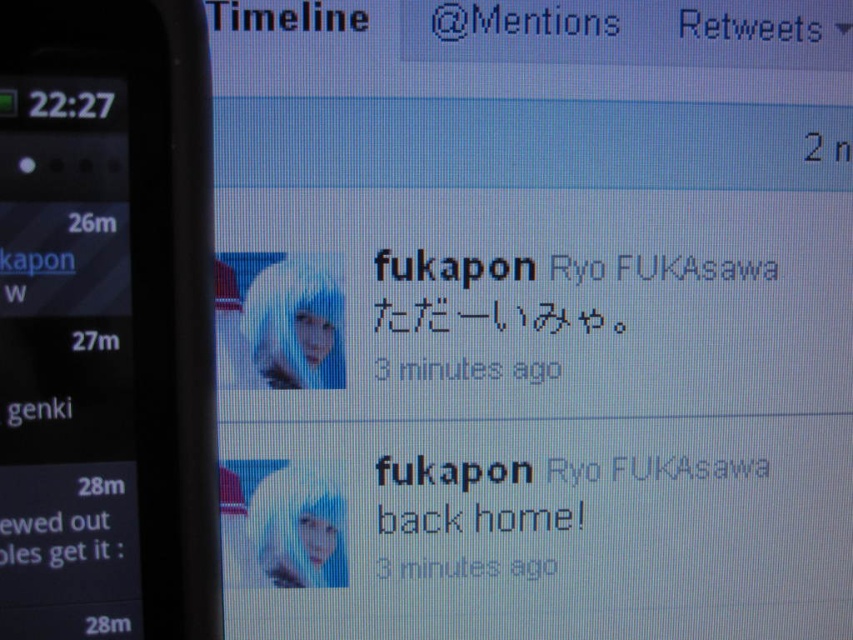
Question: Is black matte text at center bigger than black plastic smartphone at left?

Choices:
 (A) no
 (B) yes

Answer: (B)

Question: Can you confirm if black matte text at center is smaller than black plastic smartphone at left?

Choices:
 (A) yes
 (B) no

Answer: (B)

Question: Which point appears farthest from the camera in this image?

Choices:
 (A) (693, 518)
 (B) (166, 176)

Answer: (A)

Question: Is black matte text at center bigger than black plastic smartphone at left?

Choices:
 (A) yes
 (B) no

Answer: (A)